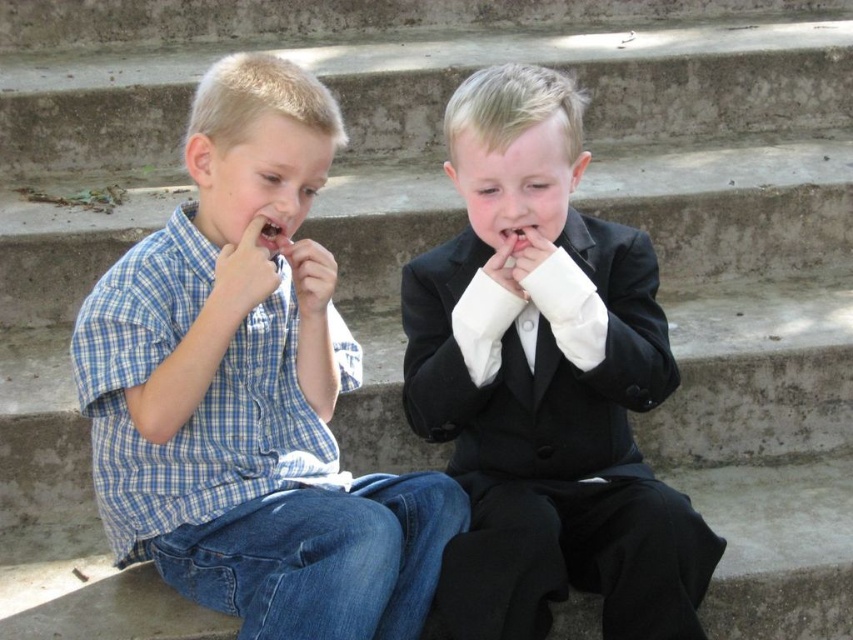
Question: Does blue plaid shirt at left lie in front of smooth white teeth at center?

Choices:
 (A) no
 (B) yes

Answer: (B)

Question: Among these objects, which one is farthest from the camera?

Choices:
 (A) smooth white teeth at center
 (B) shiny black suit at center
 (C) pink flesh at center

Answer: (C)

Question: Among these objects, which one is nearest to the camera?

Choices:
 (A) pink flesh at center
 (B) shiny black suit at center
 (C) blue plaid shirt at left

Answer: (C)

Question: Is shiny black suit at center further to the viewer compared to pink flesh at center?

Choices:
 (A) yes
 (B) no

Answer: (B)

Question: Considering the real-world distances, which object is closest to the shiny black suit at center?

Choices:
 (A) blue plaid shirt at left
 (B) smooth white teeth at center
 (C) pink flesh at center

Answer: (A)

Question: Does blue plaid shirt at left have a lesser width compared to shiny black suit at center?

Choices:
 (A) yes
 (B) no

Answer: (B)